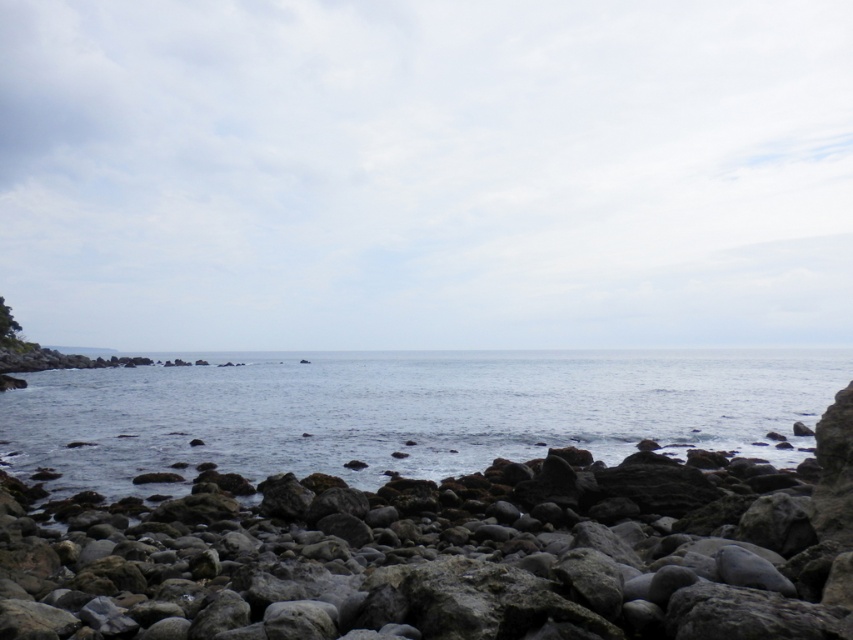
Question: Which point is closer to the camera?

Choices:
 (A) gray rock at center
 (B) clear blue water at center

Answer: (A)

Question: Which object is closer to the camera taking this photo?

Choices:
 (A) gray rock at center
 (B) clear blue water at center

Answer: (A)

Question: Which point is closer to the camera taking this photo?

Choices:
 (A) (595, 540)
 (B) (451, 396)

Answer: (A)

Question: Does gray rock at center have a smaller size compared to clear blue water at center?

Choices:
 (A) no
 (B) yes

Answer: (B)

Question: Can you confirm if gray rock at center is bigger than clear blue water at center?

Choices:
 (A) no
 (B) yes

Answer: (A)

Question: From the image, what is the correct spatial relationship of gray rock at center in relation to clear blue water at center?

Choices:
 (A) right
 (B) left

Answer: (A)